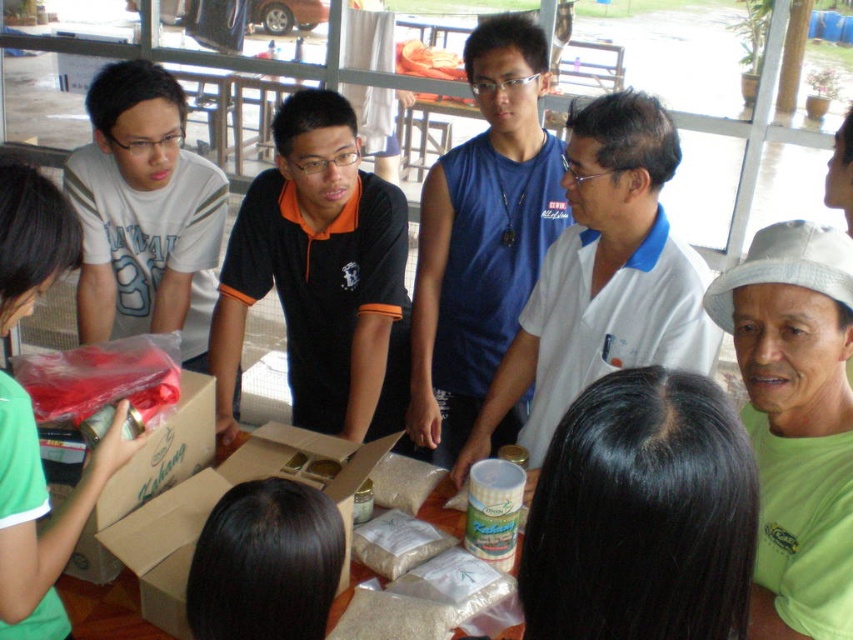
Who is higher up, black hair at center or white cotton shirt at center?

white cotton shirt at center is higher up.

Is black hair at center to the left of white cotton shirt at center from the viewer's perspective?

Indeed, black hair at center is positioned on the left side of white cotton shirt at center.

Find the location of a particular element. black hair at center is located at coordinates (642, 515).

Identify the location of black hair at center. (642, 515).

From the picture: Can you confirm if black hair at lower center is taller than white matte bag at center?

Correct, black hair at lower center is much taller as white matte bag at center.

Does black hair at lower center have a smaller size compared to white matte bag at center?

Incorrect, black hair at lower center is not smaller in size than white matte bag at center.

Locate an element on the screen. The height and width of the screenshot is (640, 853). black hair at lower center is located at coordinates (265, 563).

Is black hair at center positioned at the back of cardboard box at lower left?

That is False.

Who is taller, black hair at center or cardboard box at lower left?

With more height is cardboard box at lower left.

Is point (698, 556) closer to camera compared to point (152, 445)?

Yes, it is in front of point (152, 445).

Where is `black hair at center`? This screenshot has width=853, height=640. black hair at center is located at coordinates (642, 515).